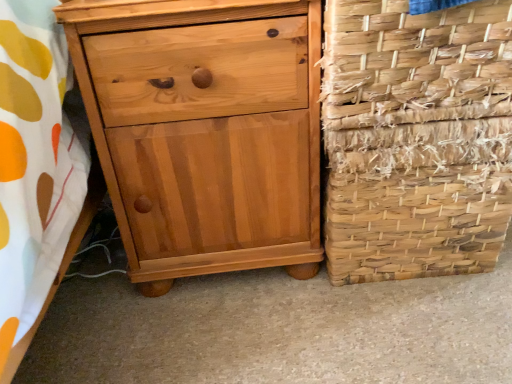
Where is `free point in front of light brown wood chest of drawers at left`? The image size is (512, 384). free point in front of light brown wood chest of drawers at left is located at coordinates (238, 337).